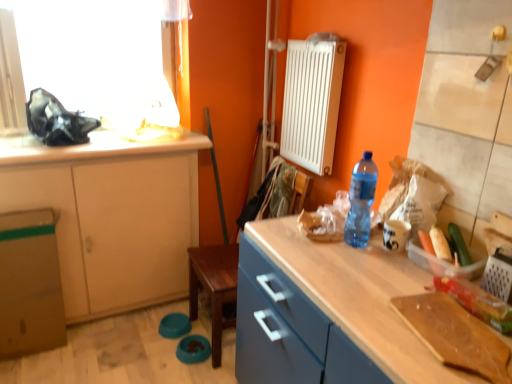
Identify the location of vacant area that is in front of blue plastic bottle at right. (352, 274).